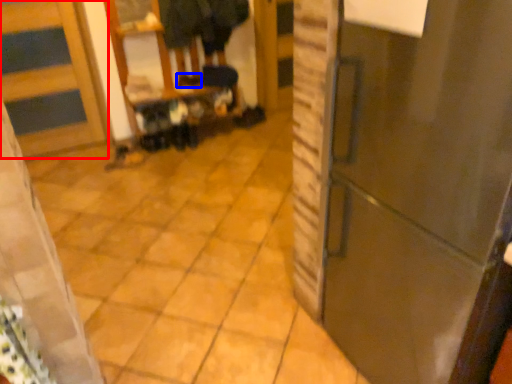
Question: Among these objects, which one is farthest to the camera, door (highlighted by a red box) or shoe (highlighted by a blue box)?

Choices:
 (A) door
 (B) shoe

Answer: (B)